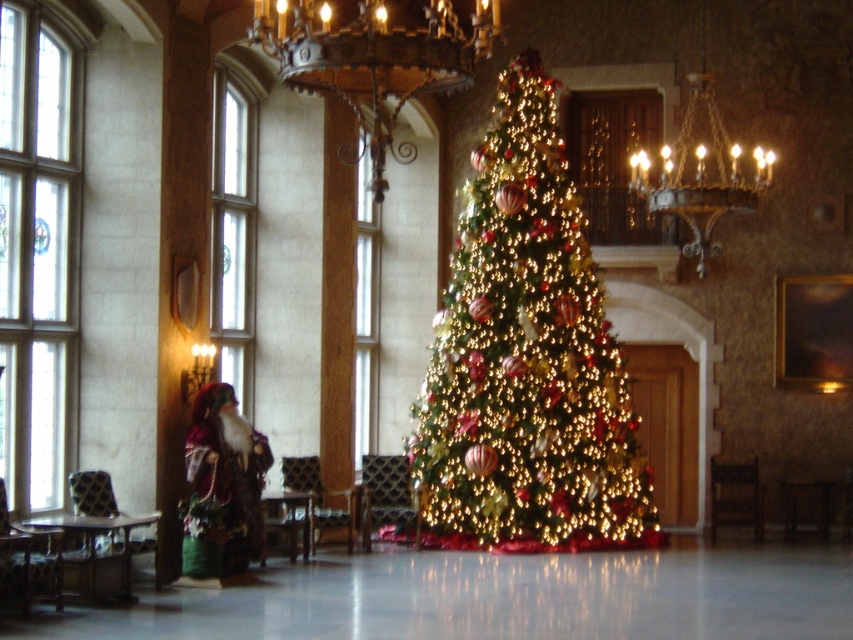
You are a visitor in this grand room and want to know which object is taller between the iridescent gold christmas tree at center and the velvet plush santa at left. Can you tell me?

The iridescent gold christmas tree at center is taller than the velvet plush santa at left.